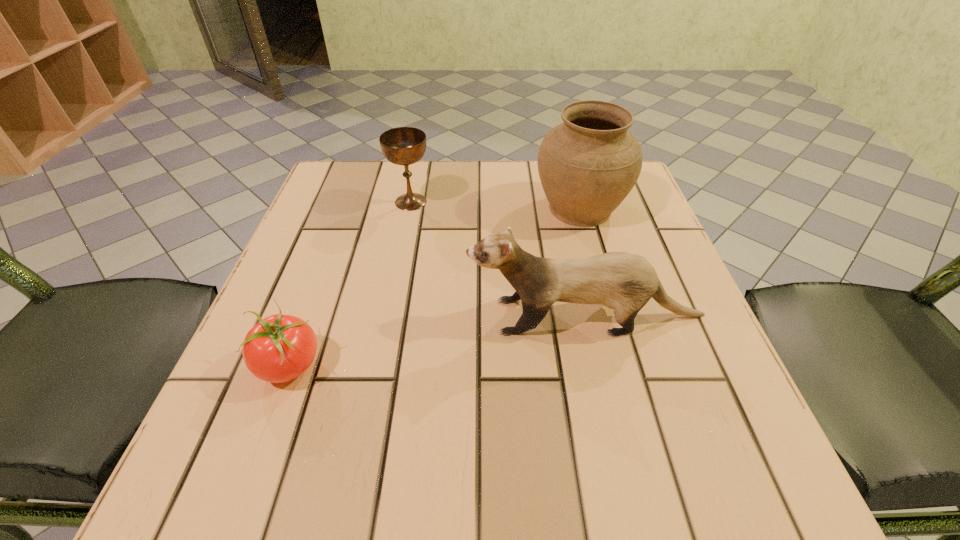
Find the location of `vacant space at the right edge`. vacant space at the right edge is located at coordinates (637, 414).

Locate an element on the screen. The width and height of the screenshot is (960, 540). vacant space at the far left corner of the desktop is located at coordinates (392, 168).

Image resolution: width=960 pixels, height=540 pixels. In the image, there is a desktop. Find the location of `vacant space at the near right corner`. vacant space at the near right corner is located at coordinates (728, 448).

Where is `vacant region between the ferret and the shortest object`? The height and width of the screenshot is (540, 960). vacant region between the ferret and the shortest object is located at coordinates (438, 340).

At what (x,y) coordinates should I click in order to perform the action: click on free spot between the leftmost object and the second object from left to right. Please return your answer as a coordinate pair (x, y). The image size is (960, 540). Looking at the image, I should click on (350, 283).

Locate an element on the screen. The height and width of the screenshot is (540, 960). free point between the urn and the tomato is located at coordinates (435, 286).

Where is `vacant area that lies between the leftmost object and the ferret`? This screenshot has width=960, height=540. vacant area that lies between the leftmost object and the ferret is located at coordinates (438, 340).

Image resolution: width=960 pixels, height=540 pixels. What are the coordinates of `vacant area that lies between the leftmost object and the urn` in the screenshot? It's located at (435, 286).

Image resolution: width=960 pixels, height=540 pixels. What are the coordinates of `free spot between the urn and the chalice` in the screenshot? It's located at (495, 205).

Where is `free spot between the tallest object and the second object from left to right`? The height and width of the screenshot is (540, 960). free spot between the tallest object and the second object from left to right is located at coordinates (495, 205).